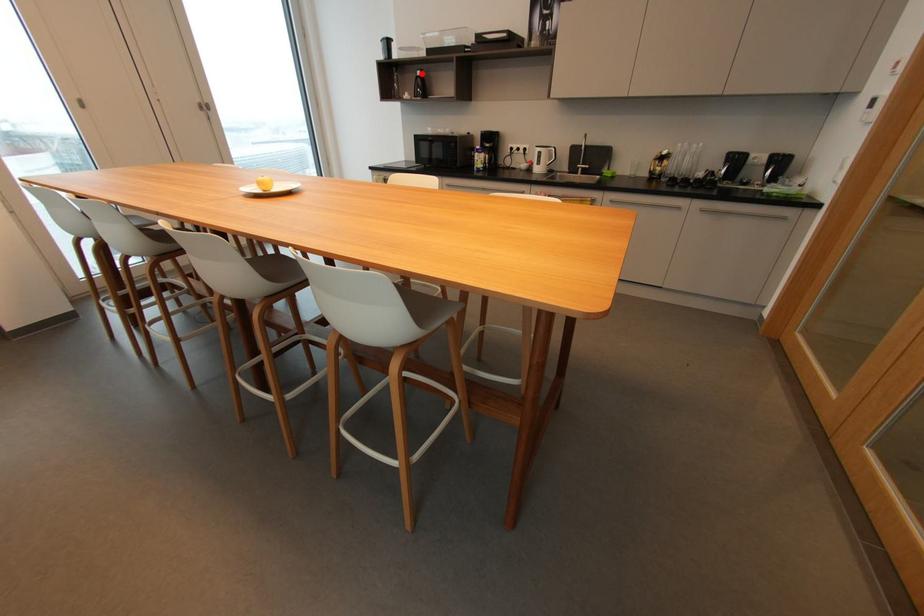
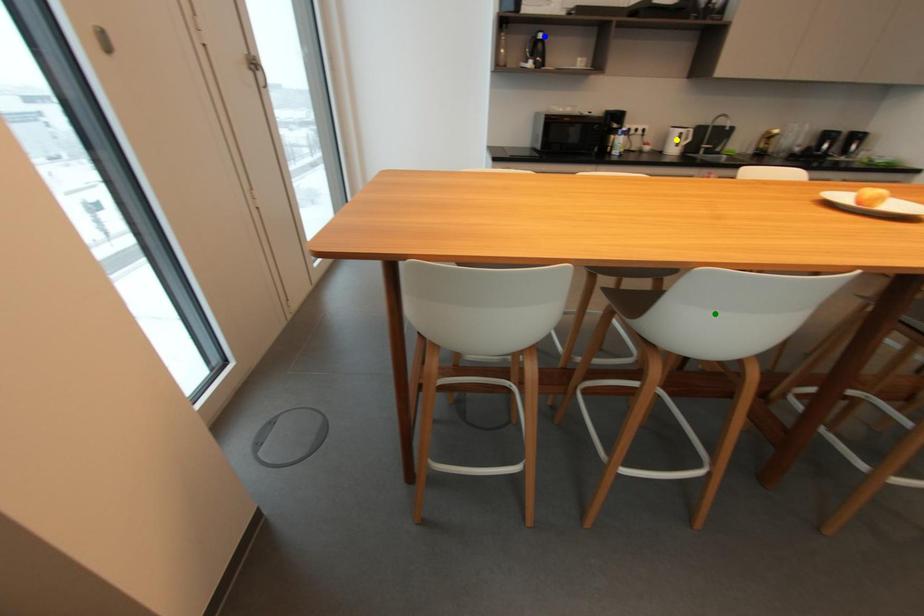
Question: I am providing you with two images of the same scene from different viewpoints. A red point is marked on the first image. You are given multiple points on the second image. Which point in image 2 represents the same 3d spot as the red point in image 1?

Choices:
 (A) blue point
 (B) yellow point
 (C) green point

Answer: (A)